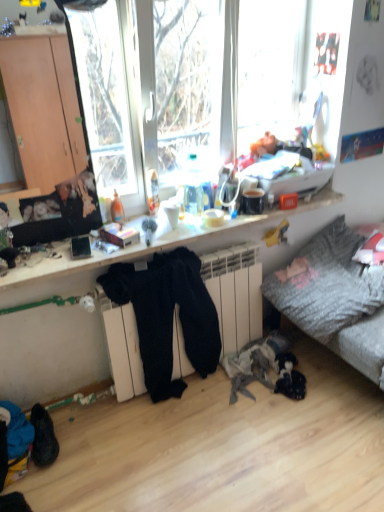
Locate an element on the screen. vacant area located to the right-hand side of black suede shoes at lower left is located at coordinates (92, 439).